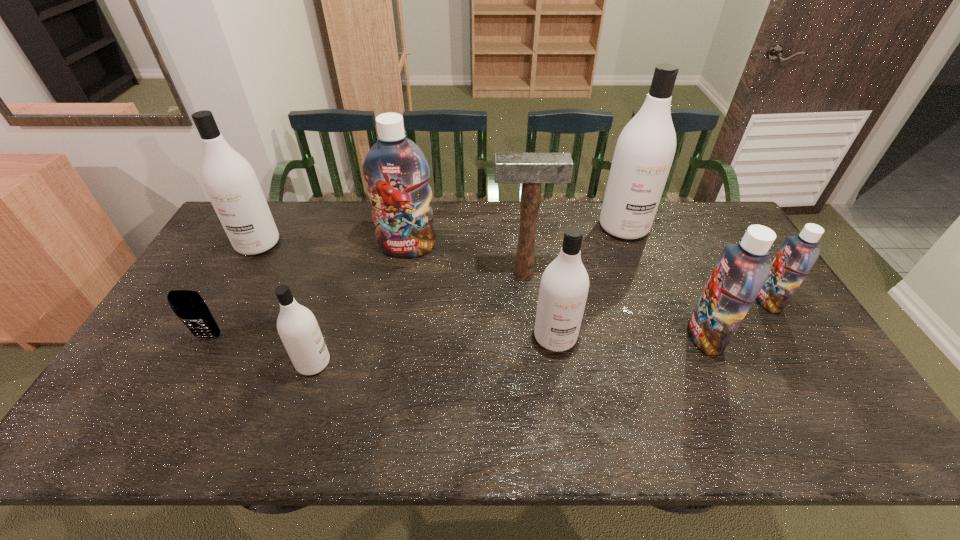
Image resolution: width=960 pixels, height=540 pixels. In order to click on the tallest shampoo in this screenshot , I will do `click(645, 149)`.

At what (x,y) coordinates should I click in order to perform the action: click on the tallest object. Please return your answer as a coordinate pair (x, y). Image resolution: width=960 pixels, height=540 pixels. Looking at the image, I should click on (645, 149).

You are a GUI agent. You are given a task and a screenshot of the screen. Output one action in this format:
    pyautogui.click(x=<x>, y=<y>)
    Task: Click on the leftmost white shampoo
    
    Given the screenshot: What is the action you would take?
    pyautogui.click(x=229, y=180)

The height and width of the screenshot is (540, 960). I want to click on the second biggest white shampoo, so click(x=229, y=180).

I want to click on the fifth shampoo from right to left, so coord(396,171).

This screenshot has height=540, width=960. I want to click on the farthest blue shampoo, so click(x=396, y=171).

Image resolution: width=960 pixels, height=540 pixels. I want to click on mallet, so click(531, 169).

Find the location of `the second smallest blue shampoo`. the second smallest blue shampoo is located at coordinates (743, 268).

Locate an element on the screen. the third biggest white shampoo is located at coordinates 564,286.

Image resolution: width=960 pixels, height=540 pixels. What are the coordinates of `the fourth shampoo from right to left` in the screenshot? It's located at (564, 286).